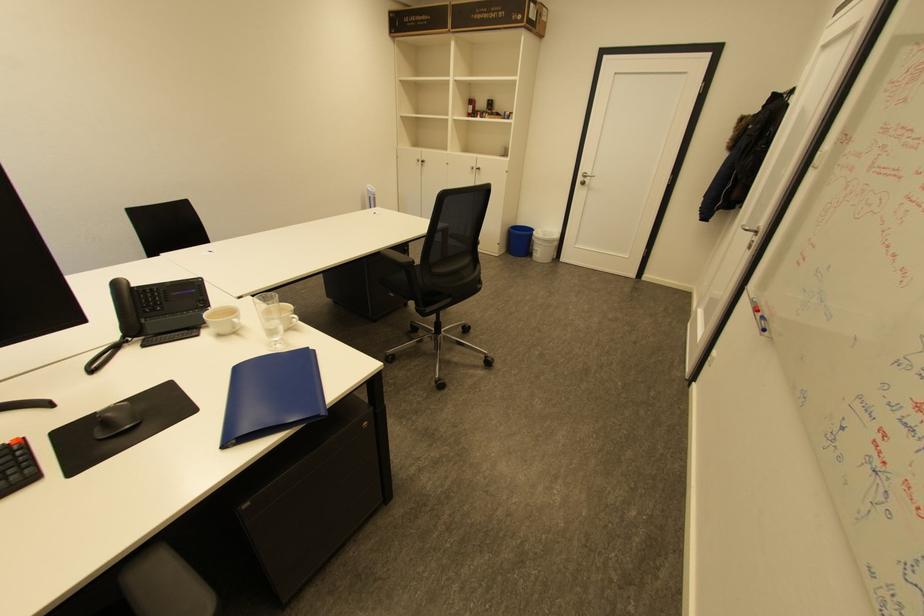
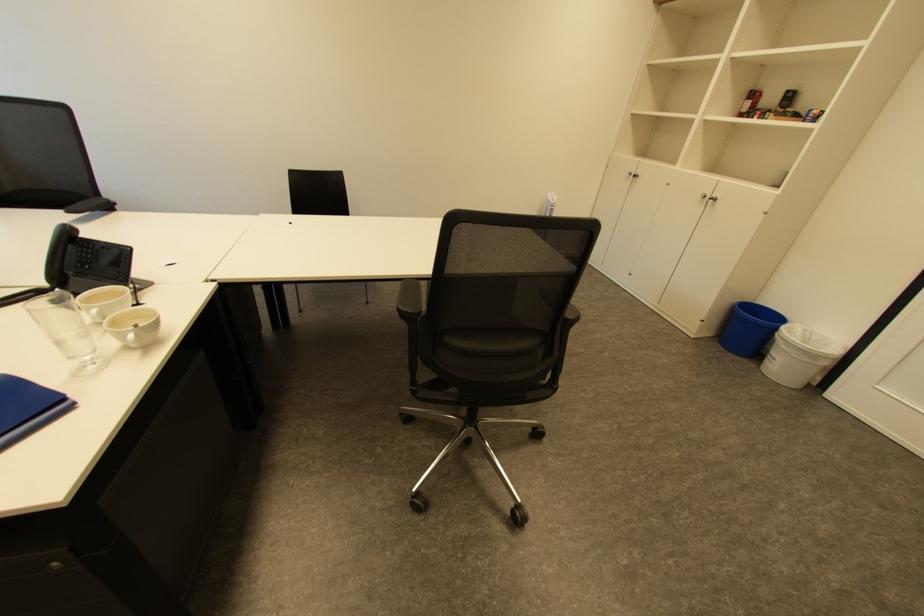
Find the pixel in the second image that matches point (424, 160) in the first image.

(638, 174)